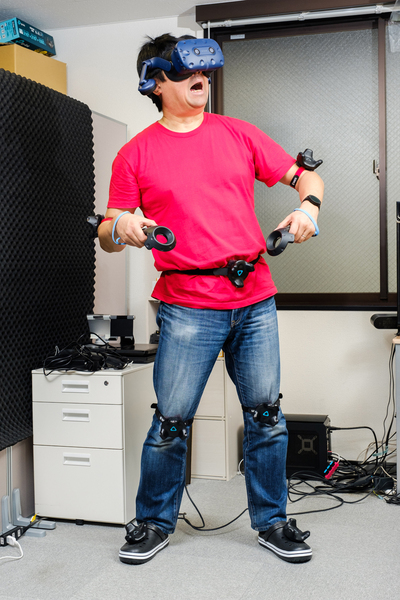
You are a GUI agent. You are given a task and a screenshot of the screen. Output one action in this format:
    pyautogui.click(x=<x>, y=<y>)
    Task: Click on the large sound absorbing pad
    
    Given the screenshot: What is the action you would take?
    pyautogui.click(x=30, y=215)